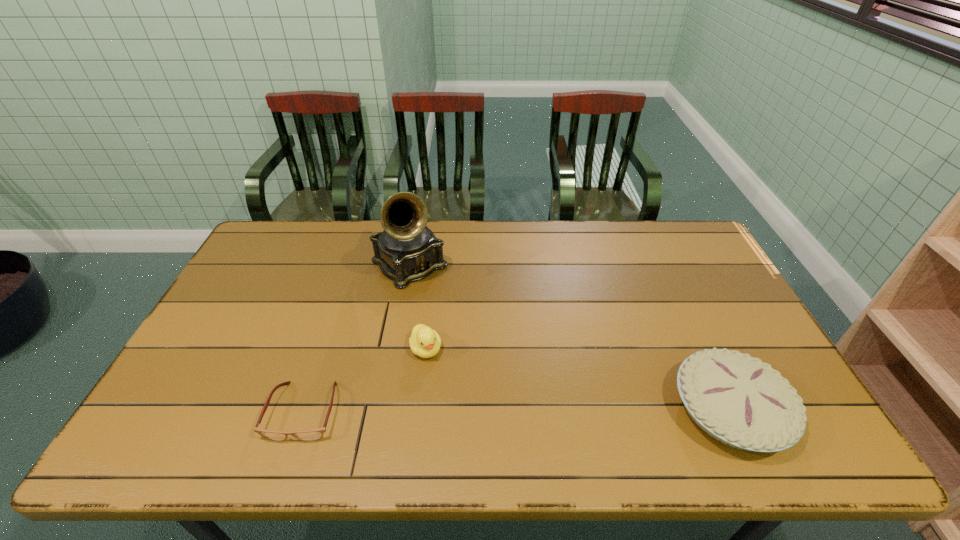
I want to click on free space that is in between the pie and the duckling, so coord(578,379).

Identify the location of free space between the phonograph record and the duckling. The height and width of the screenshot is (540, 960). (418, 307).

The image size is (960, 540). Find the location of `empty space between the shortest object and the pie`. empty space between the shortest object and the pie is located at coordinates (516, 410).

Image resolution: width=960 pixels, height=540 pixels. I want to click on vacant region between the rightmost object and the duckling, so [578, 379].

The width and height of the screenshot is (960, 540). Find the location of `vacant space in between the rightmost object and the duckling`. vacant space in between the rightmost object and the duckling is located at coordinates (578, 379).

Locate an element on the screen. Image resolution: width=960 pixels, height=540 pixels. free area in between the duckling and the farthest object is located at coordinates pyautogui.click(x=418, y=307).

Find the location of a particular element. The image size is (960, 540). free area in between the duckling and the spectacles is located at coordinates (365, 380).

Find the location of a particular element. This screenshot has width=960, height=540. empty space that is in between the rightmost object and the spectacles is located at coordinates (516, 410).

The image size is (960, 540). I want to click on free space that is in between the tallest object and the duckling, so click(418, 307).

You are a GUI agent. You are given a task and a screenshot of the screen. Output one action in this format:
    pyautogui.click(x=<x>, y=<y>)
    Task: Click on the vacant area that lies between the duckling and the farthest object
    The width and height of the screenshot is (960, 540).
    Given the screenshot: What is the action you would take?
    pos(418,307)